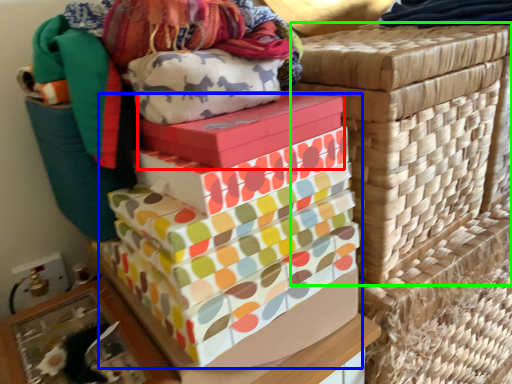
Question: Which object is the farthest from gift box (highlighted by a red box)? Choose among these: gift box (highlighted by a blue box) or basket container (highlighted by a green box).

Choices:
 (A) gift box
 (B) basket container

Answer: (B)